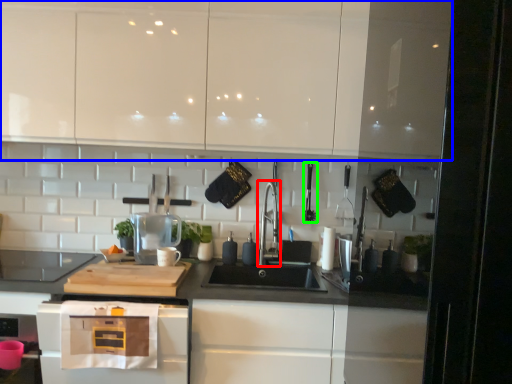
Question: Estimate the real-world distances between objects in this image. Which object is closer to faucet (highlighted by a red box), cabinetry (highlighted by a blue box) or appliance (highlighted by a green box)?

Choices:
 (A) cabinetry
 (B) appliance

Answer: (B)